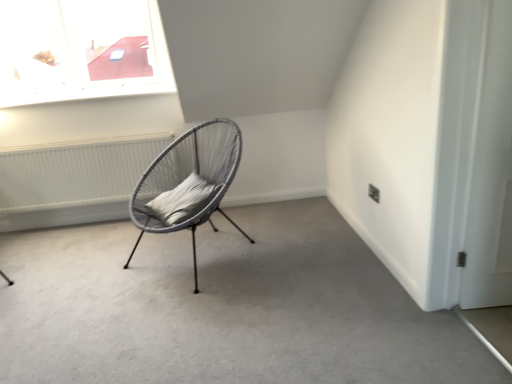
Locate an element on the screen. vacant area that is in front of white matte door at right is located at coordinates (498, 315).